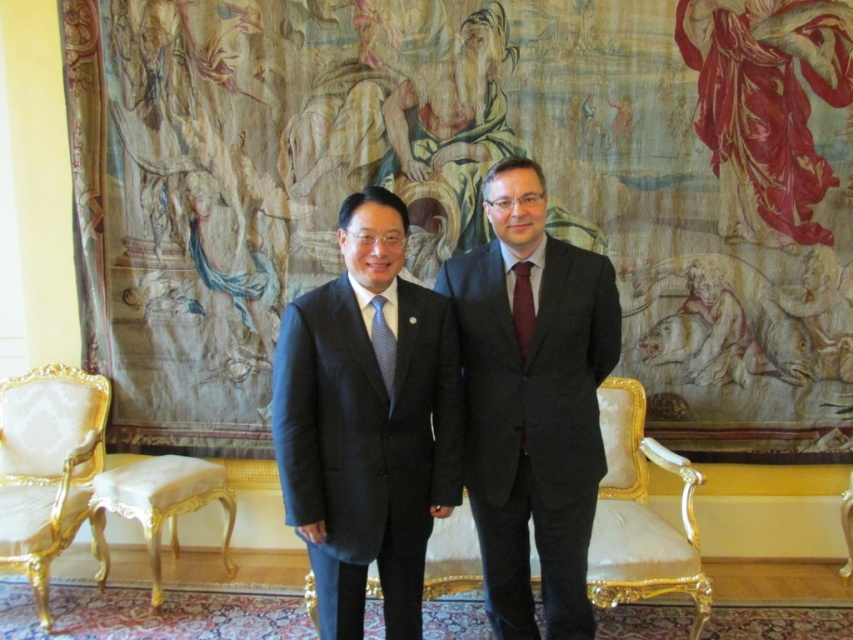
You are a photographer setting up for a formal event. You need to ensure that the matte black suit at center and the maroon satin tie at center are both visible in your shot. Based on their positions, which object is closer to the right edge of the frame?

The matte black suit at center is to the right of the maroon satin tie at center, so the matte black suit at center is closer to the right edge of the frame.

You are a photographer preparing to take a portrait of the two individuals in the image. You need to ensure there is enough space between the matte black suit at center and the blue dotted tie at center to avoid them overlapping in the photo. The minimum required distance for no overlap is 18 inches. Is the current spacing sufficient?

The distance between the matte black suit at center and the blue dotted tie at center is 18.90 inches, which exceeds the minimum required 18 inches. Therefore, the current spacing is sufficient to prevent overlap in the photo.

Consider the image. You are a photographer setting up for a formal event. You need to ensure that the matte black suit at center and the blue dotted tie at center are both visible in your shot. Given that your camera has a fixed focal length, which object should you prioritize framing closer to the center of the frame to ensure both are captured clearly?

The matte black suit at center should be prioritized closer to the center of the frame because its width is larger than the blue dotted tie at center, making it more critical to capture its full detail without cropping.